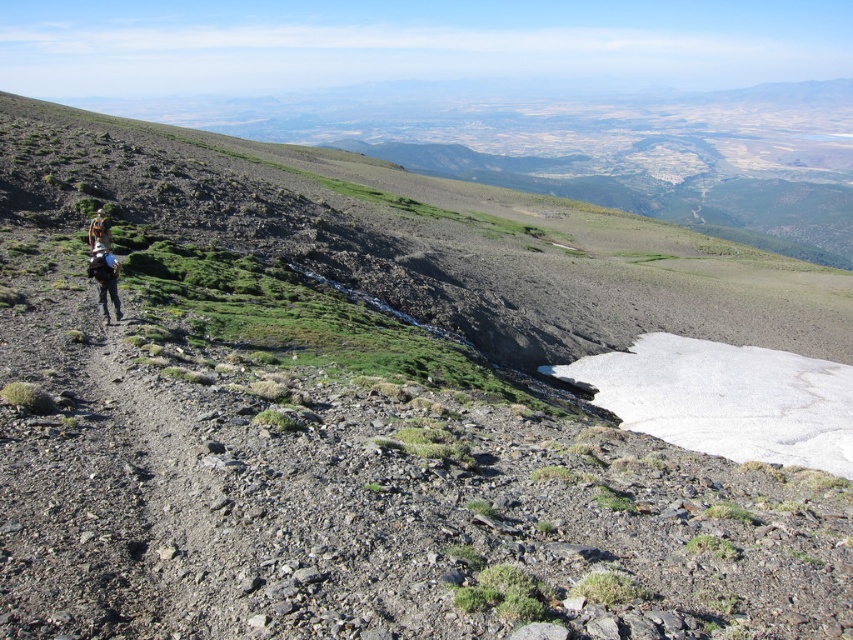
Question: Considering the relative positions of matte black backpack at lower left and camouflage jacket at left in the image provided, where is matte black backpack at lower left located with respect to camouflage jacket at left?

Choices:
 (A) above
 (B) below

Answer: (B)

Question: From the image, what is the correct spatial relationship of dull gray gravel at center in relation to camouflage jacket at left?

Choices:
 (A) above
 (B) below

Answer: (B)

Question: Estimate the real-world distances between objects in this image. Which object is closer to the camouflage jacket at left?

Choices:
 (A) dull gray gravel at center
 (B) matte black backpack at lower left

Answer: (B)

Question: Which point is closer to the camera?

Choices:
 (A) [x=207, y=605]
 (B) [x=112, y=289]

Answer: (A)

Question: Does dull gray gravel at center have a larger size compared to camouflage jacket at left?

Choices:
 (A) no
 (B) yes

Answer: (A)

Question: Which point is closer to the camera taking this photo?

Choices:
 (A) (90, 241)
 (B) (115, 317)
 (C) (151, 500)

Answer: (C)